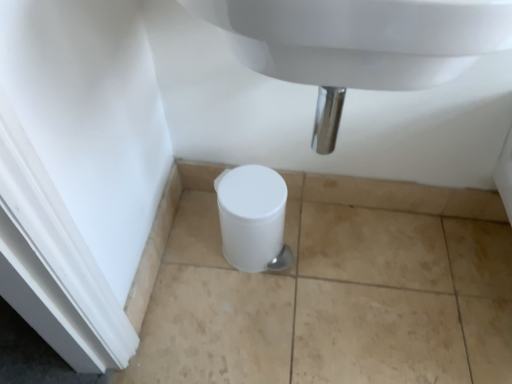
Question: Visually, is white plastic toilet at lower center positioned to the left or to the right of white glossy sink at center?

Choices:
 (A) right
 (B) left

Answer: (B)

Question: Looking at the image, does white plastic toilet at lower center seem bigger or smaller compared to white glossy sink at center?

Choices:
 (A) big
 (B) small

Answer: (B)

Question: From a real-world perspective, is white plastic toilet at lower center physically located above or below white glossy sink at center?

Choices:
 (A) below
 (B) above

Answer: (A)

Question: Is white glossy sink at center spatially inside white plastic toilet at lower center, or outside of it?

Choices:
 (A) outside
 (B) inside

Answer: (A)

Question: Considering the positions of point (473, 18) and point (241, 243), is point (473, 18) closer or farther from the camera than point (241, 243)?

Choices:
 (A) closer
 (B) farther

Answer: (A)

Question: Considering the positions of white glossy sink at center and white plastic toilet at lower center in the image, is white glossy sink at center taller or shorter than white plastic toilet at lower center?

Choices:
 (A) tall
 (B) short

Answer: (A)

Question: From the image's perspective, is white glossy sink at center above or below white plastic toilet at lower center?

Choices:
 (A) below
 (B) above

Answer: (B)